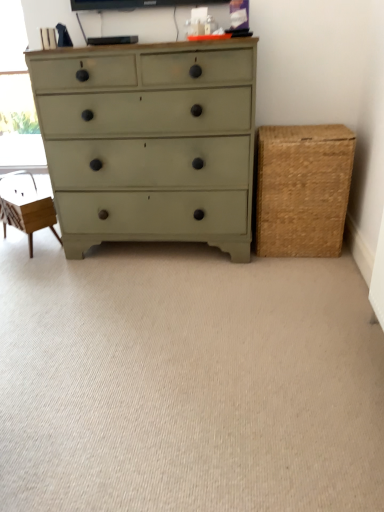
Identify the location of beige carpet at center. The height and width of the screenshot is (512, 384). (186, 381).

Identify the location of satin green dresser at center. Image resolution: width=384 pixels, height=512 pixels. (150, 144).

Identify the location of beige carpet at center. The height and width of the screenshot is (512, 384). (186, 381).

Can we say transparent glass window screen at upper left lies outside braided wicker basket at right?

Yes, transparent glass window screen at upper left is located beyond the bounds of braided wicker basket at right.

Which of these two, transparent glass window screen at upper left or braided wicker basket at right, stands taller?

With more height is transparent glass window screen at upper left.

Are transparent glass window screen at upper left and braided wicker basket at right located far from each other?

Yes, transparent glass window screen at upper left is far from braided wicker basket at right.

Is transparent glass window screen at upper left smaller than braided wicker basket at right?

Yes.

Does braided wicker basket at right turn towards transparent glass window screen at upper left?

No, braided wicker basket at right does not turn towards transparent glass window screen at upper left.

Is braided wicker basket at right smaller than transparent glass window screen at upper left?

Incorrect, braided wicker basket at right is not smaller in size than transparent glass window screen at upper left.

Could you measure the distance between braided wicker basket at right and transparent glass window screen at upper left?

They are 9.22 feet apart.

Where is `basket above the wooden swivel chair at left (from the image's perspective)`? Image resolution: width=384 pixels, height=512 pixels. basket above the wooden swivel chair at left (from the image's perspective) is located at coordinates (302, 189).

Between braided wicker basket at right and wooden swivel chair at left, which one is positioned in front?

braided wicker basket at right is closer to the camera.

Looking at this image, considering the relative positions of braided wicker basket at right and wooden swivel chair at left in the image provided, is braided wicker basket at right to the left or to the right of wooden swivel chair at left?

braided wicker basket at right is positioned on wooden swivel chair at left's right side.

Is braided wicker basket at right bigger than wooden swivel chair at left?

Indeed, braided wicker basket at right has a larger size compared to wooden swivel chair at left.

From the image's perspective, which object appears higher, beige carpet at center or transparent glass window screen at upper left?

transparent glass window screen at upper left.

Which point is more forward, [41,329] or [37,127]?

The point [41,329] is closer to the camera.

Is beige carpet at center beside transparent glass window screen at upper left?

No, beige carpet at center is not in contact with transparent glass window screen at upper left.

Considering the relative sizes of beige carpet at center and satin green dresser at center in the image provided, is beige carpet at center thinner than satin green dresser at center?

No, beige carpet at center is not thinner than satin green dresser at center.

Do you think beige carpet at center is within satin green dresser at center, or outside of it?

beige carpet at center is not enclosed by satin green dresser at center.

Does beige carpet at center have a larger size compared to satin green dresser at center?

No, beige carpet at center is not bigger than satin green dresser at center.

You are a GUI agent. You are given a task and a screenshot of the screen. Output one action in this format:
    pyautogui.click(x=<x>, y=<y>)
    Task: Click on the chest of drawers that is on the right side of beige carpet at center
    This screenshot has height=512, width=384.
    Given the screenshot: What is the action you would take?
    pyautogui.click(x=150, y=144)

From the image's perspective, which one is positioned lower, braided wicker basket at right or beige carpet at center?

From the image's view, beige carpet at center is below.

Which object is positioned more to the left, braided wicker basket at right or beige carpet at center?

beige carpet at center.

Are braided wicker basket at right and beige carpet at center far apart?

No, braided wicker basket at right is not far away from beige carpet at center.

From a real-world perspective, is transparent glass window screen at upper left positioned under wooden swivel chair at left based on gravity?

No.

From the image's perspective, is transparent glass window screen at upper left over wooden swivel chair at left?

Yes.

From the picture: In terms of height, does transparent glass window screen at upper left look taller or shorter compared to wooden swivel chair at left?

In the image, transparent glass window screen at upper left appears to be taller than wooden swivel chair at left.

Is transparent glass window screen at upper left completely or partially outside of wooden swivel chair at left?

Indeed, transparent glass window screen at upper left is completely outside wooden swivel chair at left.

Identify the location of basket on the right of transparent glass window screen at upper left. (302, 189).

Identify the location of window screen behind the braided wicker basket at right. (17, 97).

Based on the photo, from the image, which object appears to be farther from transparent glass window screen at upper left, braided wicker basket at right or beige carpet at center?

beige carpet at center is positioned further to the anchor transparent glass window screen at upper left.

Estimate the real-world distances between objects in this image. Which object is closer to satin green dresser at center, braided wicker basket at right or wooden swivel chair at left?

Based on the image, braided wicker basket at right appears to be nearer to satin green dresser at center.

Based on their spatial positions, is braided wicker basket at right or satin green dresser at center further from transparent glass window screen at upper left?

The object further to transparent glass window screen at upper left is braided wicker basket at right.

From the image, which object appears to be nearer to beige carpet at center, transparent glass window screen at upper left or braided wicker basket at right?

braided wicker basket at right is positioned closer to the anchor beige carpet at center.

When comparing their distances from braided wicker basket at right, does beige carpet at center or transparent glass window screen at upper left seem closer?

The object closer to braided wicker basket at right is beige carpet at center.

When comparing their distances from beige carpet at center, does braided wicker basket at right or wooden swivel chair at left seem further?

Among the two, wooden swivel chair at left is located further to beige carpet at center.

Which object lies nearer to the anchor point wooden swivel chair at left, beige carpet at center or transparent glass window screen at upper left?

beige carpet at center lies closer to wooden swivel chair at left than the other object.

From the image, which object appears to be nearer to braided wicker basket at right, wooden swivel chair at left or transparent glass window screen at upper left?

wooden swivel chair at left.

The width and height of the screenshot is (384, 512). What are the coordinates of `the chest of drawers positioned between beige carpet at center and transparent glass window screen at upper left from near to far` in the screenshot? It's located at (150, 144).

Locate an element on the screen. The image size is (384, 512). swivel chair between transparent glass window screen at upper left and braided wicker basket at right is located at coordinates (25, 206).

The image size is (384, 512). I want to click on chest of drawers between transparent glass window screen at upper left and braided wicker basket at right in the horizontal direction, so click(150, 144).

Where is `the chest of drawers located between beige carpet at center and braided wicker basket at right in the depth direction`? This screenshot has width=384, height=512. the chest of drawers located between beige carpet at center and braided wicker basket at right in the depth direction is located at coordinates click(x=150, y=144).